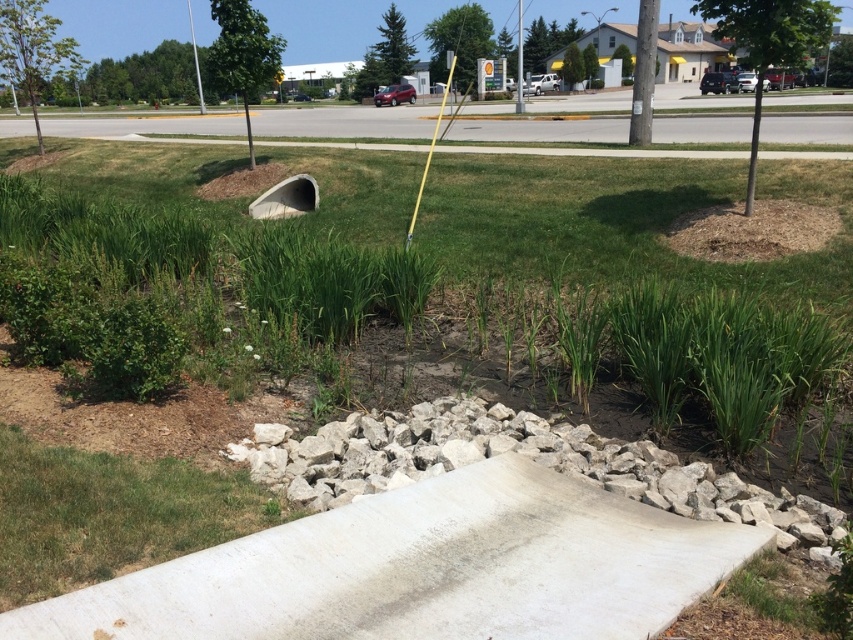
Question: Is white gravel at lower center positioned in front of concrete tunnel at center?

Choices:
 (A) yes
 (B) no

Answer: (A)

Question: Based on their relative distances, which object is farther from the white gravel at lower center?

Choices:
 (A) white concrete ramp at lower center
 (B) green grass at lower left

Answer: (B)

Question: Does white concrete ramp at lower center have a lesser width compared to white gravel at lower center?

Choices:
 (A) yes
 (B) no

Answer: (A)

Question: From the image, what is the correct spatial relationship of white concrete ramp at lower center in relation to concrete tunnel at center?

Choices:
 (A) left
 (B) right

Answer: (B)

Question: Which point is closer to the camera taking this photo?

Choices:
 (A) (296, 188)
 (B) (125, 483)
 (C) (100, 614)

Answer: (C)

Question: Which object appears closest to the camera in this image?

Choices:
 (A) white gravel at lower center
 (B) white concrete ramp at lower center
 (C) green grass at lower left
 (D) concrete tunnel at center

Answer: (B)